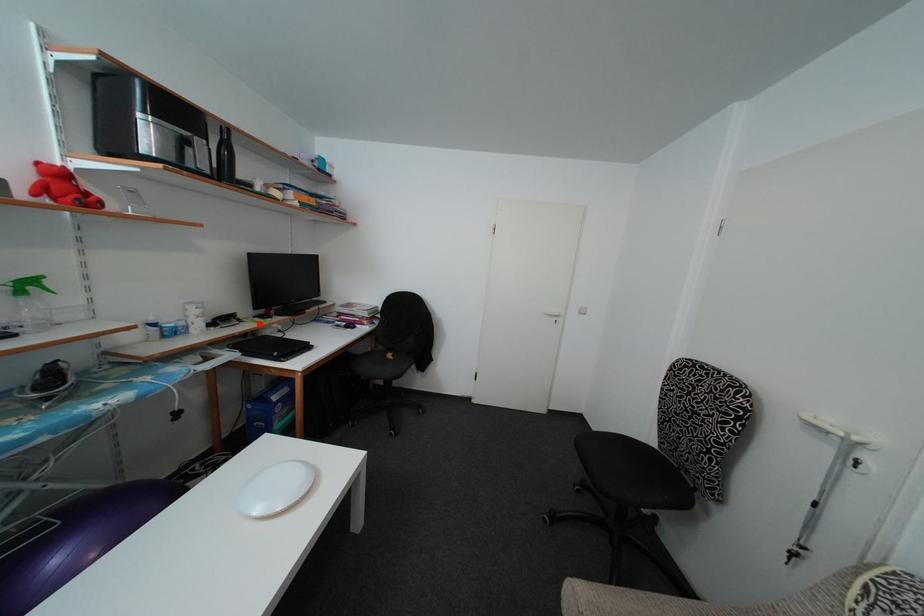
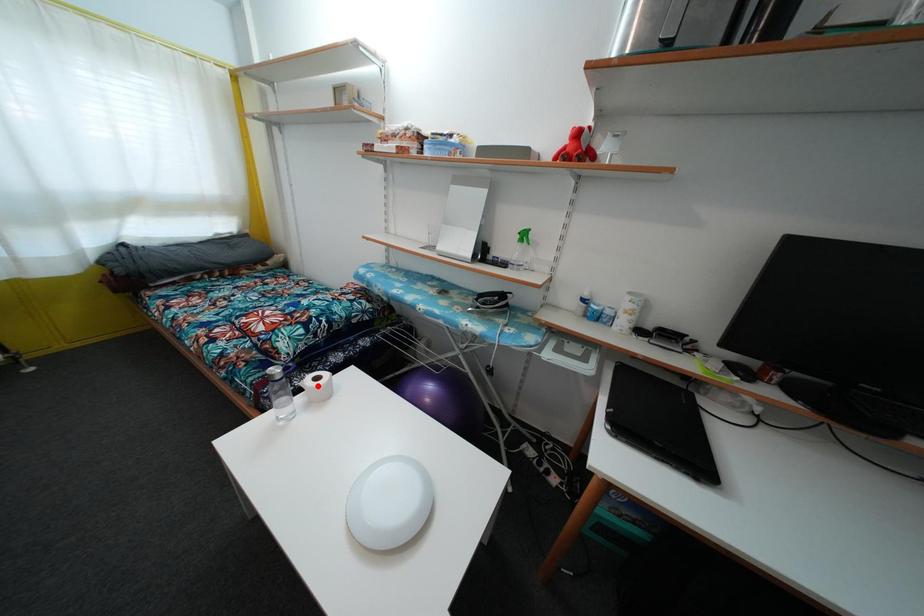
I am providing you with two images of the same scene from different viewpoints. A red point is marked on the first image and another point is marked on the second image. Do the highlighted points in image1 and image2 indicate the same real-world spot?

No